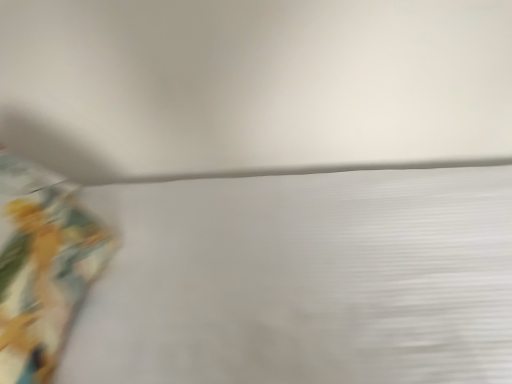
The image size is (512, 384). Describe the element at coordinates (42, 269) in the screenshot. I see `matte yellow curtain at left` at that location.

What are the coordinates of `matte yellow curtain at left` in the screenshot? It's located at (42, 269).

Locate an element on the screen. white textured sheet at lower left is located at coordinates (303, 280).

The image size is (512, 384). Describe the element at coordinates (303, 280) in the screenshot. I see `white textured sheet at lower left` at that location.

Measure the distance between white textured sheet at lower left and camera.

The depth of white textured sheet at lower left is 20.51 inches.

Locate an element on the screen. matte yellow curtain at left is located at coordinates (42, 269).

Visually, is matte yellow curtain at left positioned to the left or to the right of white textured sheet at lower left?

Clearly, matte yellow curtain at left is on the left of white textured sheet at lower left in the image.

Does matte yellow curtain at left lie in front of white textured sheet at lower left?

No, matte yellow curtain at left is further to the viewer.

Is point (61, 263) positioned behind point (142, 199)?

That is False.

From the image's perspective, is matte yellow curtain at left located above white textured sheet at lower left?

No, from the image's perspective, matte yellow curtain at left is not above white textured sheet at lower left.

From a real-world perspective, which is physically above, matte yellow curtain at left or white textured sheet at lower left?

white textured sheet at lower left, from a real-world perspective.

Between matte yellow curtain at left and white textured sheet at lower left, which one has smaller width?

matte yellow curtain at left.

Based on the photo, who is taller, matte yellow curtain at left or white textured sheet at lower left?

A: With more height is white textured sheet at lower left.

Who is smaller, matte yellow curtain at left or white textured sheet at lower left?

matte yellow curtain at left is smaller.

From the picture: Is matte yellow curtain at left inside the boundaries of white textured sheet at lower left, or outside?

matte yellow curtain at left lies within the bounds of white textured sheet at lower left.

Is there a large distance between matte yellow curtain at left and white textured sheet at lower left?

No, matte yellow curtain at left is not far from white textured sheet at lower left.

Is matte yellow curtain at left positioned with its back to white textured sheet at lower left?

Yes, matte yellow curtain at left is positioned with its back facing white textured sheet at lower left.

How many degrees apart are the facing directions of matte yellow curtain at left and white textured sheet at lower left?

matte yellow curtain at left and white textured sheet at lower left are facing 2.36 degrees away from each other.

Measure the distance from matte yellow curtain at left to white textured sheet at lower left.

The distance of matte yellow curtain at left from white textured sheet at lower left is 10.20 inches.

At what (x,y) coordinates should I click in order to perform the action: click on sheet above the matte yellow curtain at left (from a real-world perspective). Please return your answer as a coordinate pair (x, y). Looking at the image, I should click on (x=303, y=280).

Would you say white textured sheet at lower left is to the left or to the right of matte yellow curtain at left in the picture?

In the image, white textured sheet at lower left appears on the right side of matte yellow curtain at left.

Considering the positions of objects white textured sheet at lower left and matte yellow curtain at left in the image provided, who is behind, white textured sheet at lower left or matte yellow curtain at left?

matte yellow curtain at left is more distant.

Does point (453, 331) come behind point (77, 237)?

No, it is not.

Based on the photo, from the image's perspective, which one is positioned higher, white textured sheet at lower left or matte yellow curtain at left?

white textured sheet at lower left, from the image's perspective.

From a real-world perspective, is white textured sheet at lower left below matte yellow curtain at left?

No, from a real-world perspective, white textured sheet at lower left is not below matte yellow curtain at left.

Which object is wider, white textured sheet at lower left or matte yellow curtain at left?

→ With larger width is white textured sheet at lower left.

Considering the relative sizes of white textured sheet at lower left and matte yellow curtain at left in the image provided, is white textured sheet at lower left taller than matte yellow curtain at left?

Indeed, white textured sheet at lower left has a greater height compared to matte yellow curtain at left.

Is white textured sheet at lower left bigger than matte yellow curtain at left?

Correct, white textured sheet at lower left is larger in size than matte yellow curtain at left.

Is white textured sheet at lower left outside of matte yellow curtain at left?

white textured sheet at lower left is positioned outside matte yellow curtain at left.

Is the surface of white textured sheet at lower left in direct contact with matte yellow curtain at left?

white textured sheet at lower left is not next to matte yellow curtain at left, and they're not touching.

Is white textured sheet at lower left looking in the opposite direction of matte yellow curtain at left?

Answer: Yes, white textured sheet at lower left is facing away from matte yellow curtain at left.

Where is `curtain below the white textured sheet at lower left (from the image's perspective)`? This screenshot has width=512, height=384. curtain below the white textured sheet at lower left (from the image's perspective) is located at coordinates (42, 269).

Where is `curtain located underneath the white textured sheet at lower left (from a real-world perspective)`? This screenshot has height=384, width=512. curtain located underneath the white textured sheet at lower left (from a real-world perspective) is located at coordinates (42, 269).

I want to click on curtain behind the white textured sheet at lower left, so click(x=42, y=269).